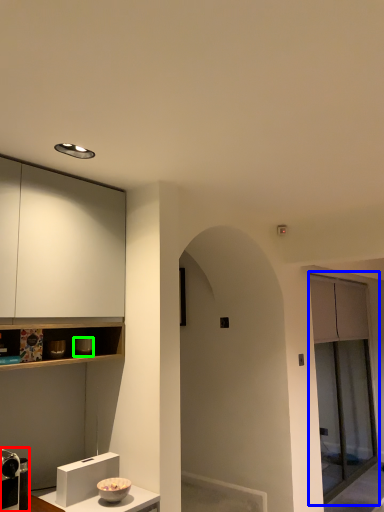
Question: Which object is positioned closest to appliance (highlighted by a red box)? Select from screen door (highlighted by a blue box) and appliance (highlighted by a green box).

Choices:
 (A) screen door
 (B) appliance

Answer: (B)